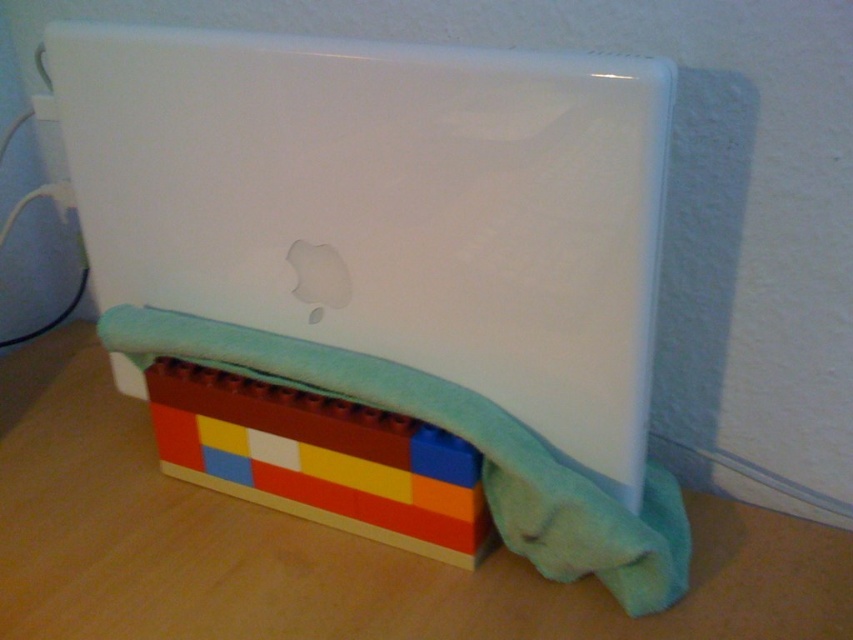
Which is below, wooden table at lower center or multicolored plastic blocks at lower center?

wooden table at lower center is lower down.

Is point (38, 570) farther from viewer compared to point (166, 451)?

That is False.

Is point (254, 588) farther from viewer compared to point (357, 499)?

No, (254, 588) is closer to viewer.

Image resolution: width=853 pixels, height=640 pixels. I want to click on wooden table at lower center, so click(321, 548).

Which is below, white glossy laptop at center or wooden table at lower center?

Positioned lower is wooden table at lower center.

Identify the location of white glossy laptop at center. (387, 208).

Find the location of a particular element. The height and width of the screenshot is (640, 853). white glossy laptop at center is located at coordinates (387, 208).

Between white glossy laptop at center and multicolored plastic blocks at lower center, which one appears on the right side from the viewer's perspective?

multicolored plastic blocks at lower center

Is white glossy laptop at center bigger than multicolored plastic blocks at lower center?

Yes, white glossy laptop at center is bigger than multicolored plastic blocks at lower center.

Is point (453, 77) farther from camera compared to point (480, 541)?

No, it is not.

You are a GUI agent. You are given a task and a screenshot of the screen. Output one action in this format:
    pyautogui.click(x=<x>, y=<y>)
    Task: Click on the white glossy laptop at center
    Image resolution: width=853 pixels, height=640 pixels.
    Given the screenshot: What is the action you would take?
    pyautogui.click(x=387, y=208)